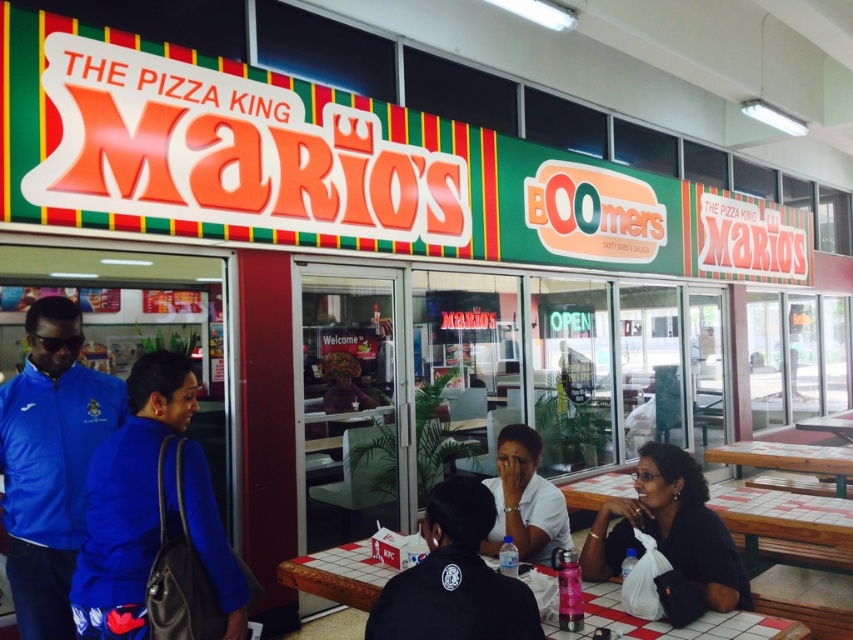
Question: Which point appears closest to the camera in this image?

Choices:
 (A) (715, 600)
 (B) (322, 557)

Answer: (A)

Question: Is black uniform at center thinner than white matte shirt at center?

Choices:
 (A) no
 (B) yes

Answer: (A)

Question: Can you confirm if blue fabric jacket at center is positioned to the left of white matte shirt at center?

Choices:
 (A) yes
 (B) no

Answer: (A)

Question: Among these points, which one is farthest from the camera?

Choices:
 (A) (735, 552)
 (B) (67, 577)
 (C) (466, 634)

Answer: (B)

Question: Which point appears closest to the camera in this image?

Choices:
 (A) (689, 627)
 (B) (657, 531)
 (C) (412, 570)

Answer: (C)

Question: Does blue fabric jacket at center have a larger size compared to checkered plastic table at lower center?

Choices:
 (A) yes
 (B) no

Answer: (A)